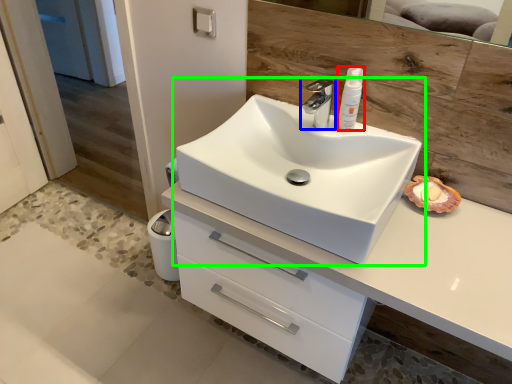
Question: Considering the real-world distances, which object is farthest from toiletry (highlighted by a red box)? tap (highlighted by a blue box) or sink (highlighted by a green box)?

Choices:
 (A) tap
 (B) sink

Answer: (B)